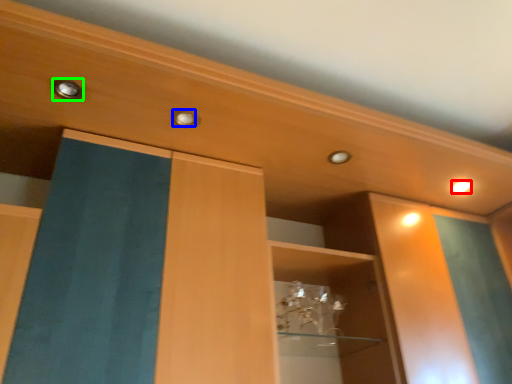
Question: Which is nearer to the lighting (highlighted by a red box)? knob (highlighted by a blue box) or knob (highlighted by a green box).

Choices:
 (A) knob
 (B) knob

Answer: (A)